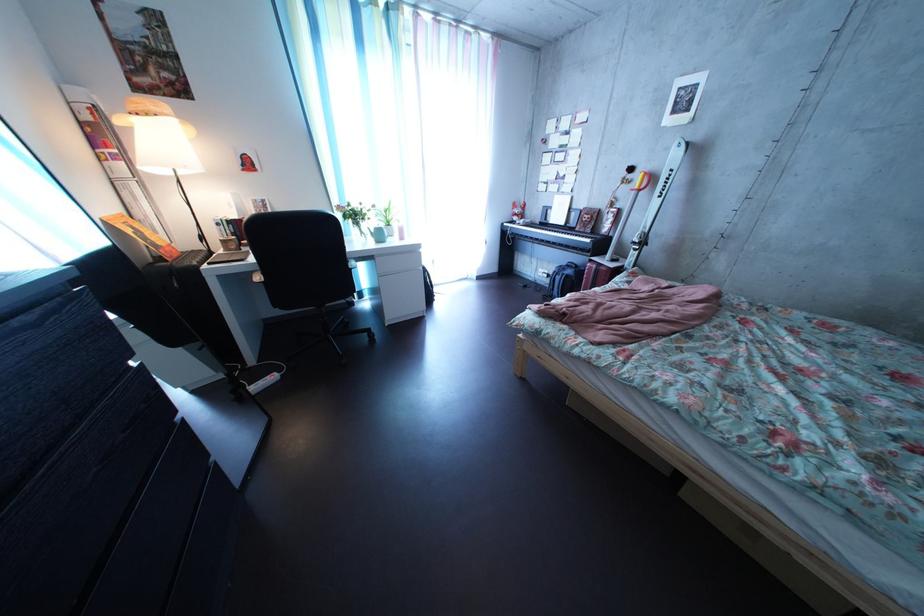
Locate an element on the screen. The width and height of the screenshot is (924, 616). blue backpack is located at coordinates (565, 280).